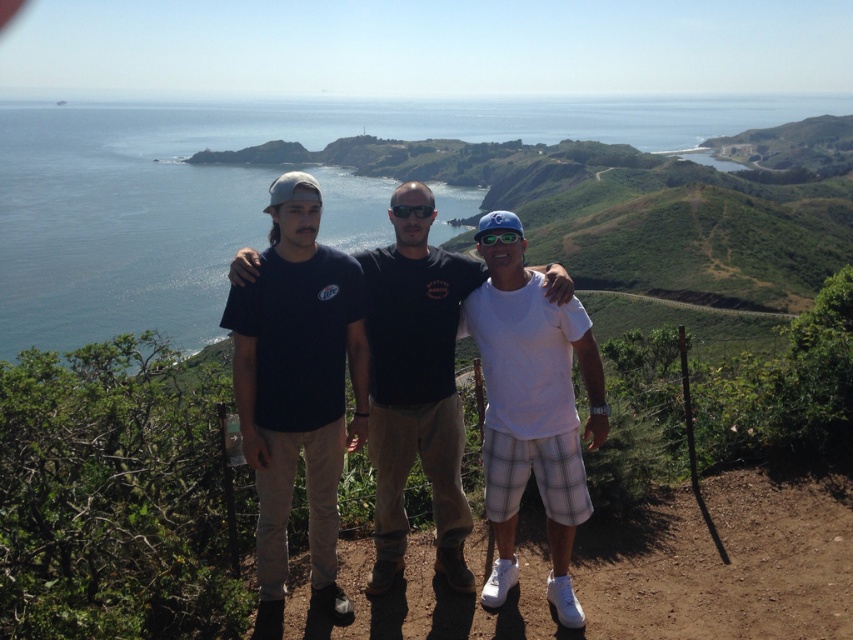
Does dark blue t-shirt at center appear on the left side of white cotton t-shirt at center?

Yes, dark blue t-shirt at center is to the left of white cotton t-shirt at center.

Which is behind, point (397, 339) or point (572, 518)?

The point (397, 339) is more distant.

This screenshot has width=853, height=640. What do you see at coordinates (416, 384) in the screenshot? I see `dark blue t-shirt at center` at bounding box center [416, 384].

Find the location of a particular element. The image size is (853, 640). dark blue t-shirt at center is located at coordinates (416, 384).

The image size is (853, 640). In order to click on black cotton t-shirt at center in this screenshot , I will do (x=299, y=388).

Does point (308, 486) come farther from viewer compared to point (498, 422)?

That is True.

You are a GUI agent. You are given a task and a screenshot of the screen. Output one action in this format:
    pyautogui.click(x=<x>, y=<y>)
    Task: Click on the black cotton t-shirt at center
    The image size is (853, 640).
    Given the screenshot: What is the action you would take?
    tap(299, 388)

Is point (340, 467) farther from viewer compared to point (445, 556)?

No, (340, 467) is in front of (445, 556).

Does point (283, 300) come closer to viewer compared to point (427, 291)?

Yes, point (283, 300) is closer to viewer.

The height and width of the screenshot is (640, 853). What are the coordinates of `black cotton t-shirt at center` in the screenshot? It's located at (299, 388).